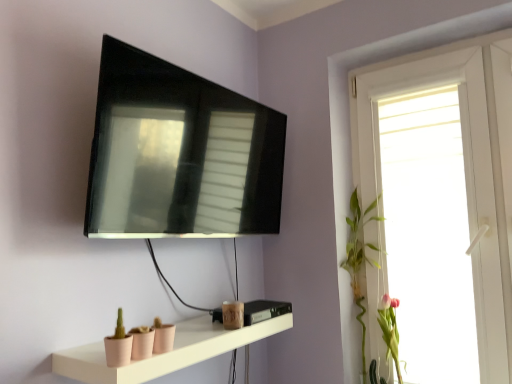
Identify the location of free spot above white glossy window at upper right (from a real-world perspective). Image resolution: width=512 pixels, height=384 pixels. (423, 45).